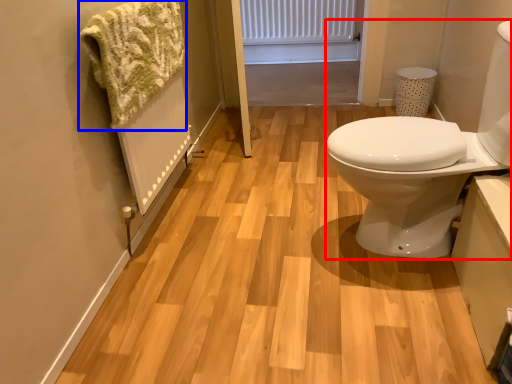
Question: Among these objects, which one is nearest to the camera, sink (highlighted by a red box) or bath towel (highlighted by a blue box)?

Choices:
 (A) sink
 (B) bath towel

Answer: (A)